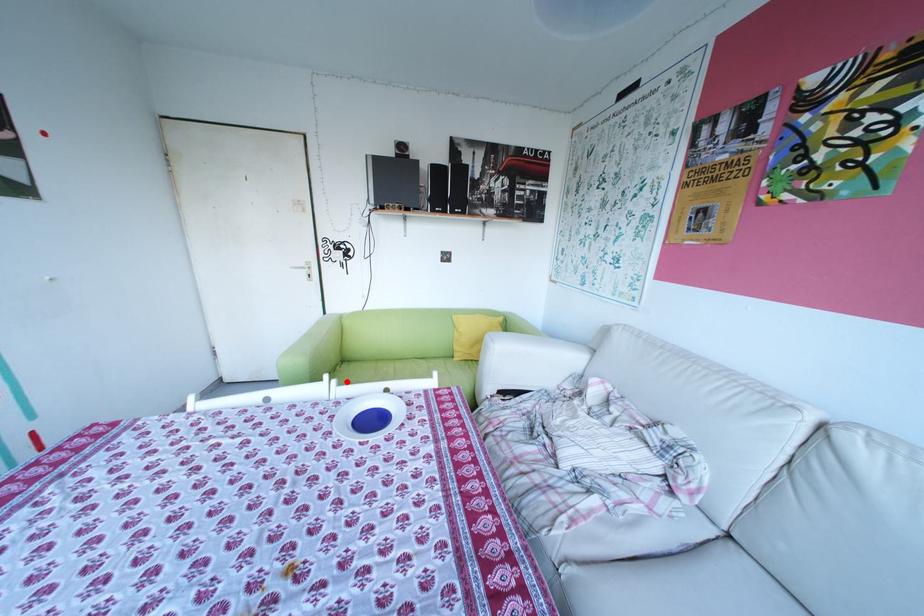
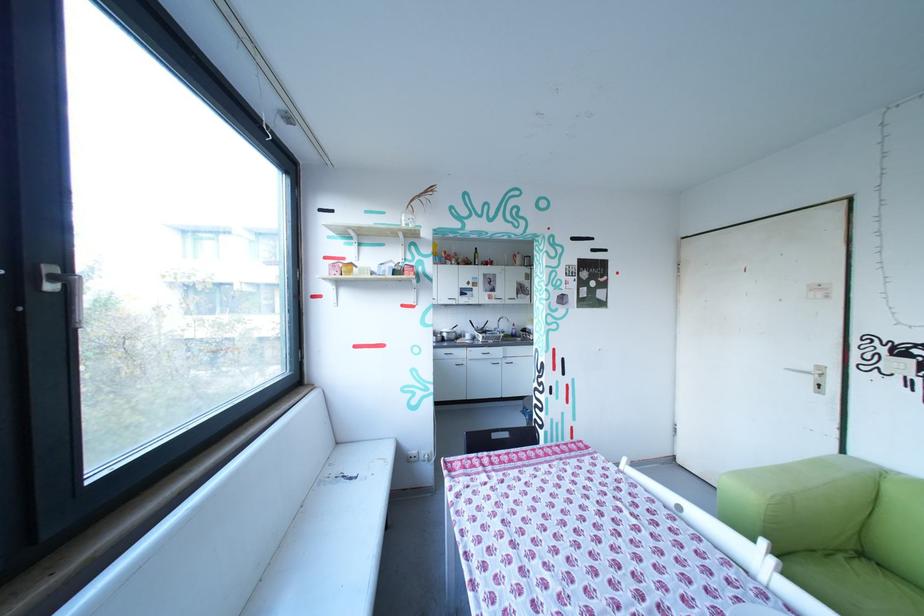
Question: I am providing you with two images of the same scene from different viewpoints. Given a red point in image1, look at the same physical point in image2. Is it:

Choices:
 (A) Closer to the viewpoint
 (B) Farther from the viewpoint

Answer: (B)